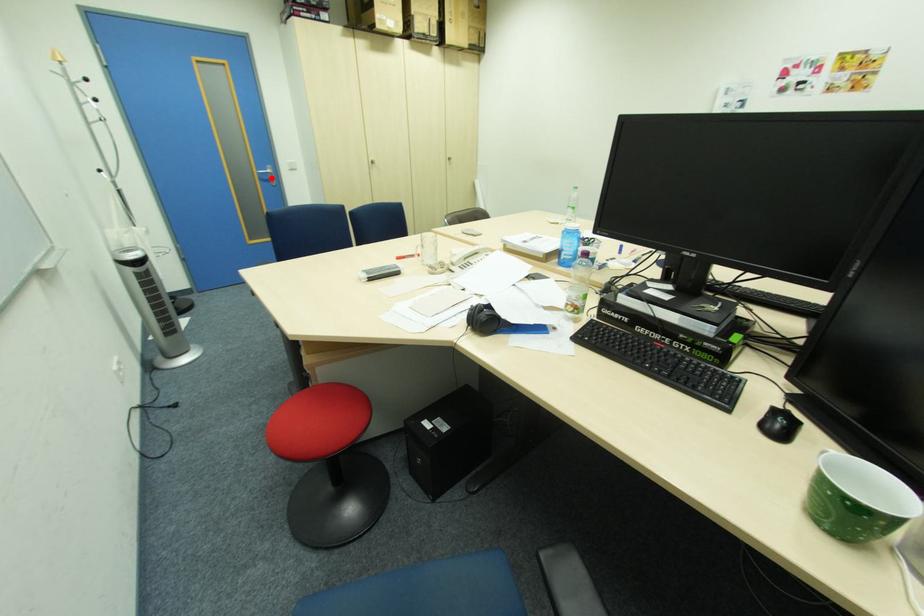
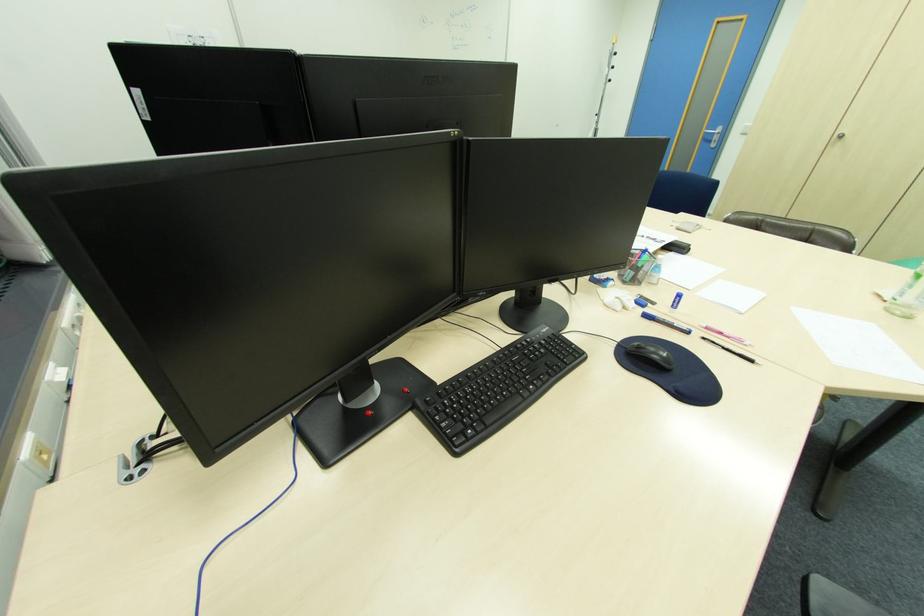
Question: I am providing you with two images of the same scene from different viewpoints. A red point is shown in image1. For the corresponding object point in image2, is it positioned nearer or farther from the camera?

Choices:
 (A) Nearer
 (B) Farther

Answer: (B)